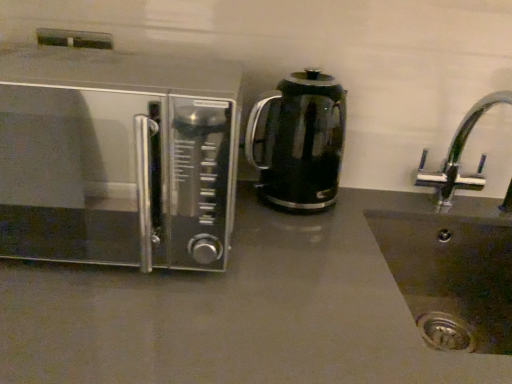
Question: Considering the relative sizes of chrome metallic faucet at right and matte gray countertop at center in the image provided, is chrome metallic faucet at right bigger than matte gray countertop at center?

Choices:
 (A) yes
 (B) no

Answer: (B)

Question: Are chrome metallic faucet at right and matte gray countertop at center located far from each other?

Choices:
 (A) no
 (B) yes

Answer: (A)

Question: Can you confirm if chrome metallic faucet at right is taller than matte gray countertop at center?

Choices:
 (A) no
 (B) yes

Answer: (A)

Question: Is chrome metallic faucet at right placed right next to matte gray countertop at center?

Choices:
 (A) yes
 (B) no

Answer: (B)

Question: Is the position of chrome metallic faucet at right more distant than that of matte gray countertop at center?

Choices:
 (A) no
 (B) yes

Answer: (B)

Question: Considering the relative positions of black glass kettle at center and chrome metallic faucet at right in the image provided, is black glass kettle at center to the left or to the right of chrome metallic faucet at right?

Choices:
 (A) left
 (B) right

Answer: (A)

Question: From the image's perspective, relative to chrome metallic faucet at right, is black glass kettle at center above or below?

Choices:
 (A) below
 (B) above

Answer: (B)

Question: From a real-world perspective, is black glass kettle at center physically located above or below chrome metallic faucet at right?

Choices:
 (A) above
 (B) below

Answer: (A)

Question: Considering the positions of black glass kettle at center and chrome metallic faucet at right in the image, is black glass kettle at center taller or shorter than chrome metallic faucet at right?

Choices:
 (A) short
 (B) tall

Answer: (A)

Question: Is satin silver microwave at left situated inside black glass kettle at center or outside?

Choices:
 (A) outside
 (B) inside

Answer: (A)

Question: In terms of width, does satin silver microwave at left look wider or thinner when compared to black glass kettle at center?

Choices:
 (A) wide
 (B) thin

Answer: (A)

Question: Based on their sizes in the image, would you say satin silver microwave at left is bigger or smaller than black glass kettle at center?

Choices:
 (A) small
 (B) big

Answer: (B)

Question: From the image's perspective, is satin silver microwave at left positioned above or below black glass kettle at center?

Choices:
 (A) above
 (B) below

Answer: (B)

Question: In the image, is chrome metallic faucet at right positioned in front of or behind black glass kettle at center?

Choices:
 (A) behind
 (B) front

Answer: (B)

Question: In the image, is chrome metallic faucet at right on the left side or the right side of black glass kettle at center?

Choices:
 (A) right
 (B) left

Answer: (A)